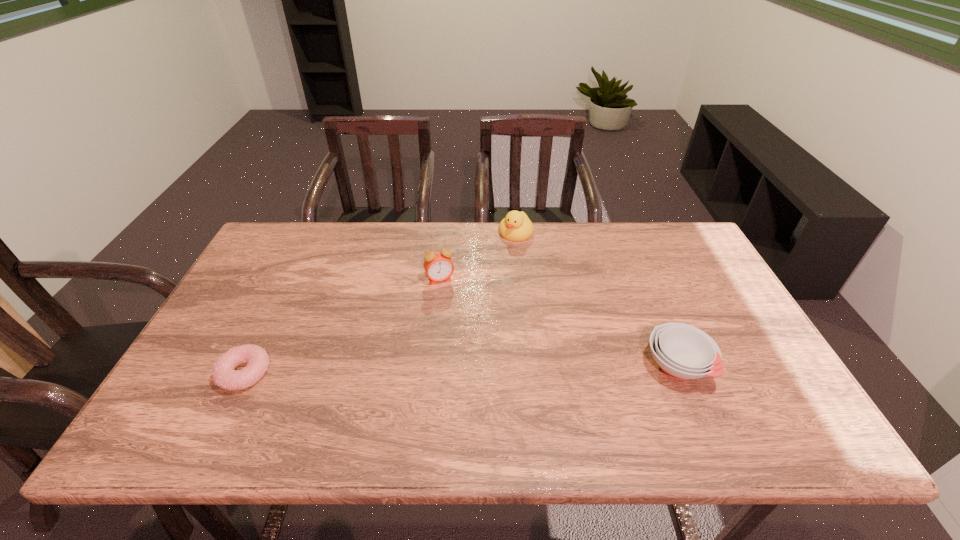
Find the location of a particular element. vacant space on the desktop that is between the shortest object and the soup bowl and is positioned on the face of the alarm clock is located at coordinates (476, 369).

Where is `vacant space on the desktop that is between the doughnut and the rightmost object and is positioned on the face of the second tallest object`? The width and height of the screenshot is (960, 540). vacant space on the desktop that is between the doughnut and the rightmost object and is positioned on the face of the second tallest object is located at coordinates coord(422,370).